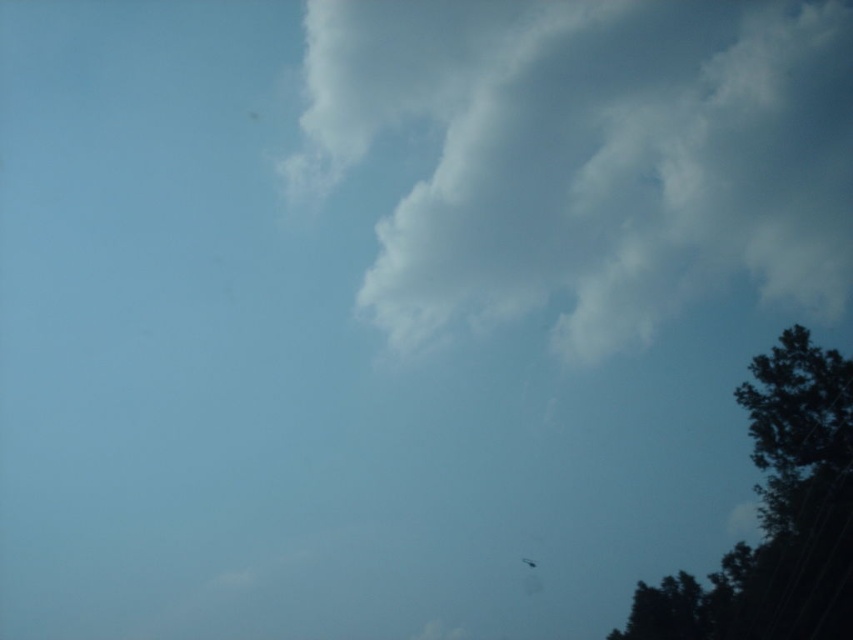
Is white fluffy cloud at upper center positioned behind translucent white fly at lower right?

No.

Which is above, white fluffy cloud at upper center or translucent white fly at lower right?

white fluffy cloud at upper center is above.

Is point (469, 198) more distant than point (526, 557)?

No, (469, 198) is in front of (526, 557).

Where is `white fluffy cloud at upper center`? This screenshot has height=640, width=853. white fluffy cloud at upper center is located at coordinates (592, 150).